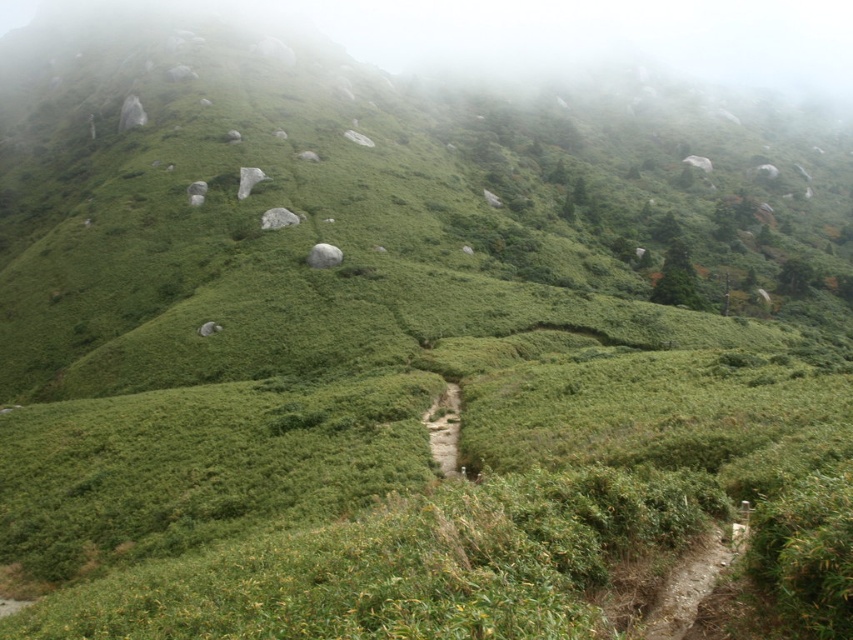
You are standing at the starting point of the path and want to reach the end of the path. There are two points marked on the path. Which point should you reach first, point (699,563) or point (445,416)?

You should reach point (445,416) first because point (699,563) is in front of it, meaning point (445,416) is closer to the starting point of the path.

You are a hiker trying to follow the path in the misty hills. You see the green grassy trail at center and the green leafy tree at upper center. Which direction should you head relative to the tree to stay on the path?

You should head to the left of the green leafy tree at upper center to stay on the green grassy trail at center since the trail is positioned to the left of the tree.